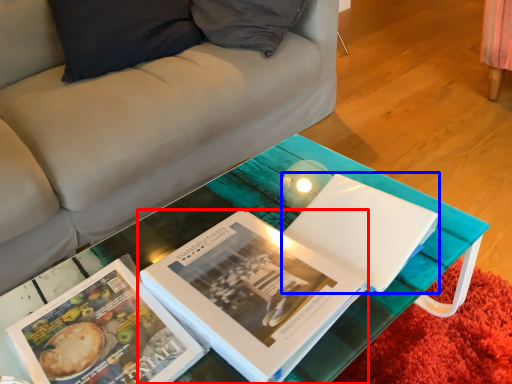
Question: Which point is closer to the camera, book (highlighted by a red box) or paperback book (highlighted by a blue box)?

Choices:
 (A) book
 (B) paperback book

Answer: (A)